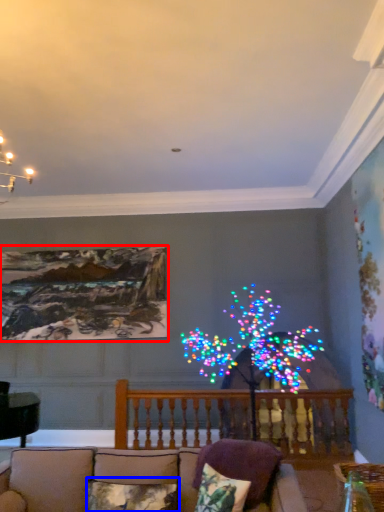
Question: Which of the following is the farthest to the observer, picture frame (highlighted by a red box) or pillow (highlighted by a blue box)?

Choices:
 (A) picture frame
 (B) pillow

Answer: (A)